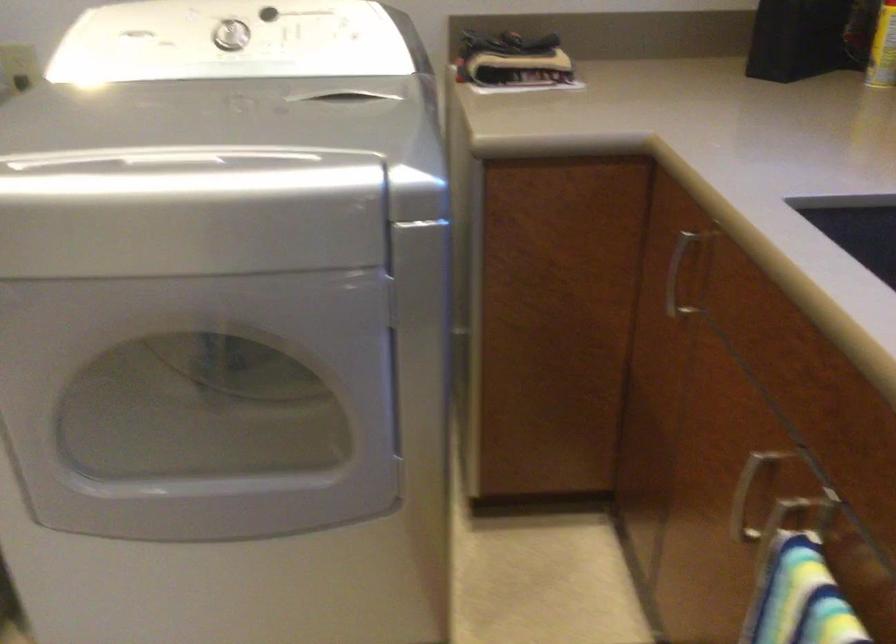
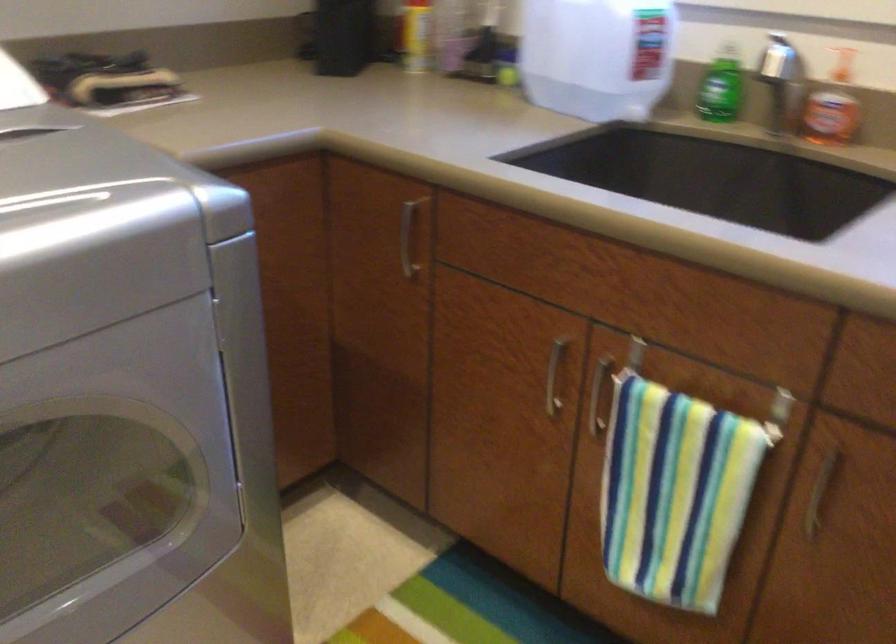
Locate, in the second image, the point that corresponds to (763,494) in the first image.

(554, 375)